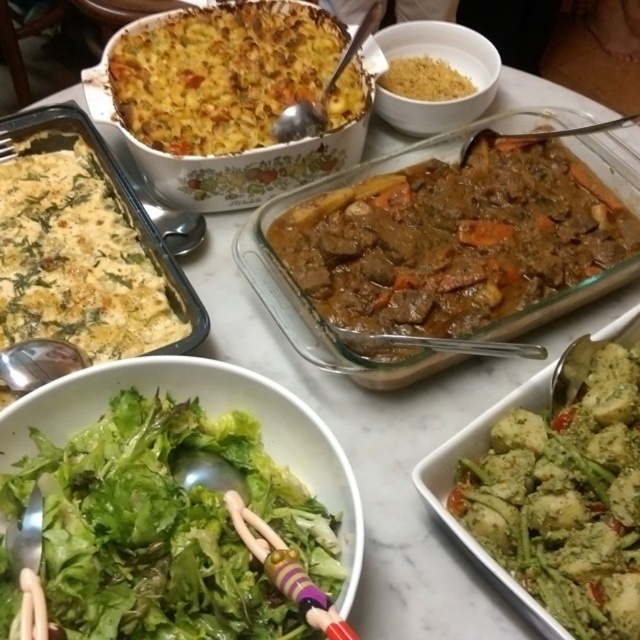
Does green leafy salad at center appear on the left side of brown crumbly at upper center?

Correct, you'll find green leafy salad at center to the left of brown crumbly at upper center.

Between green leafy salad at center and brown crumbly at upper center, which one is positioned lower?

green leafy salad at center is below.

Is point (136, 417) closer to viewer compared to point (458, 81)?

Yes, it is in front of point (458, 81).

I want to click on green leafy salad at center, so click(166, 528).

Is white creamy casserole at left below brown crumbly at upper center?

Yes, white creamy casserole at left is below brown crumbly at upper center.

At what (x,y) coordinates should I click in order to perform the action: click on white creamy casserole at left. Please return your answer as a coordinate pair (x, y). The height and width of the screenshot is (640, 640). Looking at the image, I should click on (81, 259).

Looking at this image, can you confirm if brown glossy stew at center is wider than yellow cheesy casserole at upper left?

Yes, brown glossy stew at center is wider than yellow cheesy casserole at upper left.

The width and height of the screenshot is (640, 640). Describe the element at coordinates (454, 240) in the screenshot. I see `brown glossy stew at center` at that location.

Does point (330, 323) lie in front of point (230, 52)?

Yes, it is.

The image size is (640, 640). I want to click on brown glossy stew at center, so click(x=454, y=240).